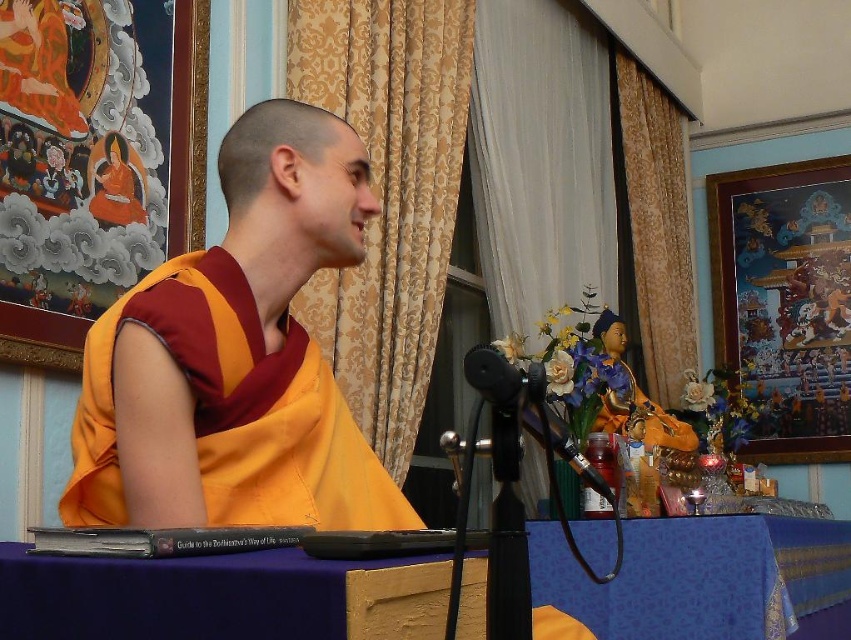
Question: Which point is farther from the camera taking this photo?

Choices:
 (A) (220, 369)
 (B) (534, 387)
 (C) (617, 632)

Answer: (C)

Question: Which point is farther from the camera taking this photo?

Choices:
 (A) tap(574, 445)
 (B) tap(631, 524)

Answer: (B)

Question: Does yellow silk robe at center have a larger size compared to black matte microphone at center?

Choices:
 (A) no
 (B) yes

Answer: (B)

Question: Estimate the real-world distances between objects in this image. Which object is farther from the purple fabric table at lower center?

Choices:
 (A) black matte microphone at center
 (B) yellow silk robe at center

Answer: (A)

Question: In this image, where is yellow silk robe at center located relative to black matte microphone at center?

Choices:
 (A) left
 (B) right

Answer: (A)

Question: Is purple fabric table at lower center to the right of black matte microphone at center from the viewer's perspective?

Choices:
 (A) no
 (B) yes

Answer: (B)